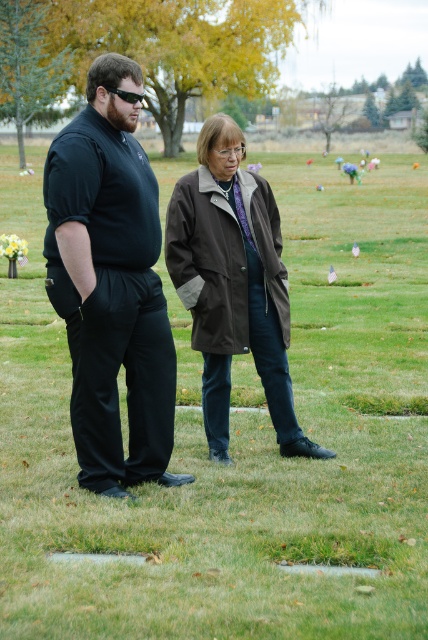
Can you confirm if matte black pants at center is positioned to the right of brown canvas coat at center?

No, matte black pants at center is not to the right of brown canvas coat at center.

How distant is matte black pants at center from brown canvas coat at center?

They are 25.89 inches apart.

Who is more distant from viewer, (148, 328) or (264, 353)?

Positioned behind is point (264, 353).

Identify the location of matte black pants at center. The width and height of the screenshot is (428, 640). (110, 284).